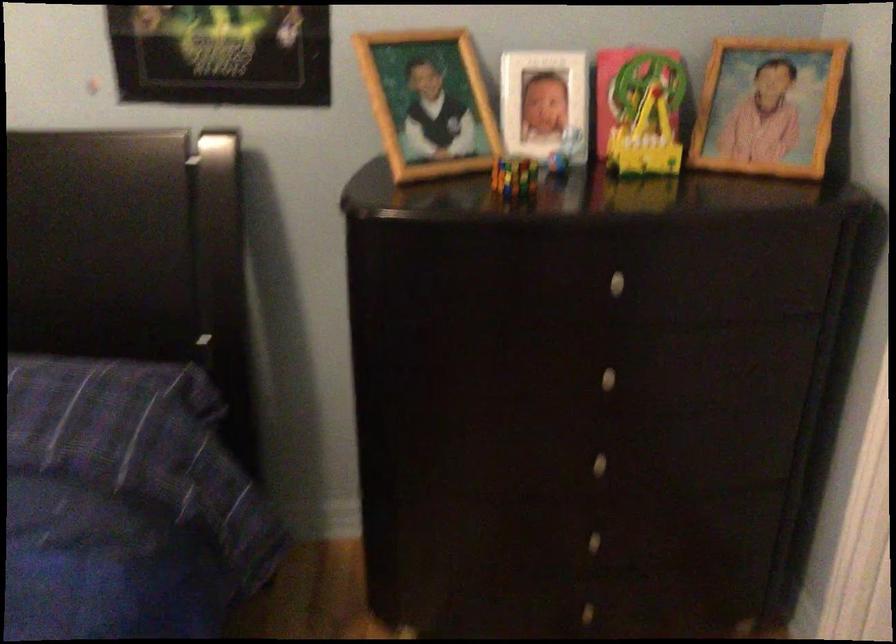
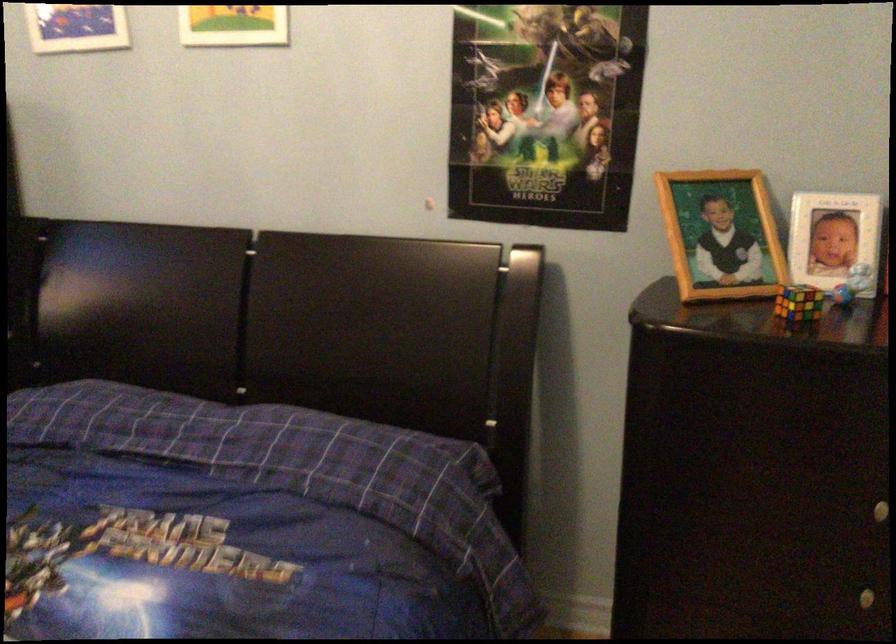
In the second image, find the point that corresponds to [564,147] in the first image.

(851, 283)